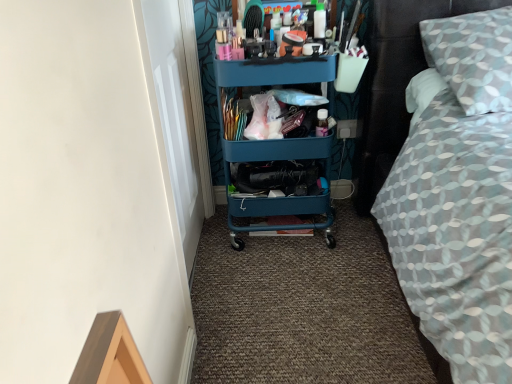
Question: Would you say patterned fabric bed at right is to the left or to the right of teal plastic cart at center in the picture?

Choices:
 (A) right
 (B) left

Answer: (A)

Question: From the image's perspective, is patterned fabric bed at right located above or below teal plastic cart at center?

Choices:
 (A) below
 (B) above

Answer: (B)

Question: Looking at their shapes, would you say patterned fabric bed at right is wider or thinner than teal plastic cart at center?

Choices:
 (A) wide
 (B) thin

Answer: (A)

Question: Which is correct: teal plastic cart at center is inside patterned fabric bed at right, or outside of it?

Choices:
 (A) outside
 (B) inside

Answer: (A)

Question: Does point tap(238, 193) appear closer or farther from the camera than point tap(401, 213)?

Choices:
 (A) farther
 (B) closer

Answer: (A)

Question: Is teal plastic cart at center wider or thinner than patterned fabric bed at right?

Choices:
 (A) wide
 (B) thin

Answer: (B)

Question: In terms of height, does teal plastic cart at center look taller or shorter compared to patterned fabric bed at right?

Choices:
 (A) tall
 (B) short

Answer: (A)